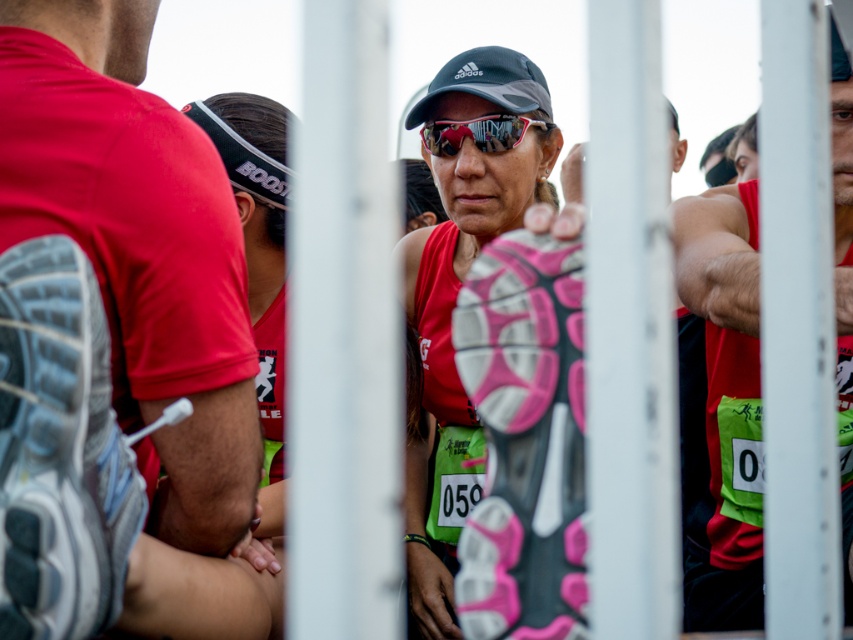
Question: Can you confirm if matte red shirt at left is positioned to the right of shiny red tank top at center?

Choices:
 (A) no
 (B) yes

Answer: (A)

Question: Can you confirm if matte red tank top at center is bigger than shiny red tank top at center?

Choices:
 (A) yes
 (B) no

Answer: (B)

Question: Estimate the real-world distances between objects in this image. Which object is farther from the matte black goggles at center?

Choices:
 (A) matte red tank top at center
 (B) matte red shirt at left
 (C) shiny red tank top at center

Answer: (B)

Question: Which of the following is the closest to the observer?

Choices:
 (A) (122, 76)
 (B) (518, 129)

Answer: (A)

Question: Is matte red tank top at center positioned before matte black goggles at center?

Choices:
 (A) no
 (B) yes

Answer: (B)

Question: Among these points, which one is nearest to the camera?

Choices:
 (A) (431, 141)
 (B) (207, 483)
 (C) (843, 339)

Answer: (B)